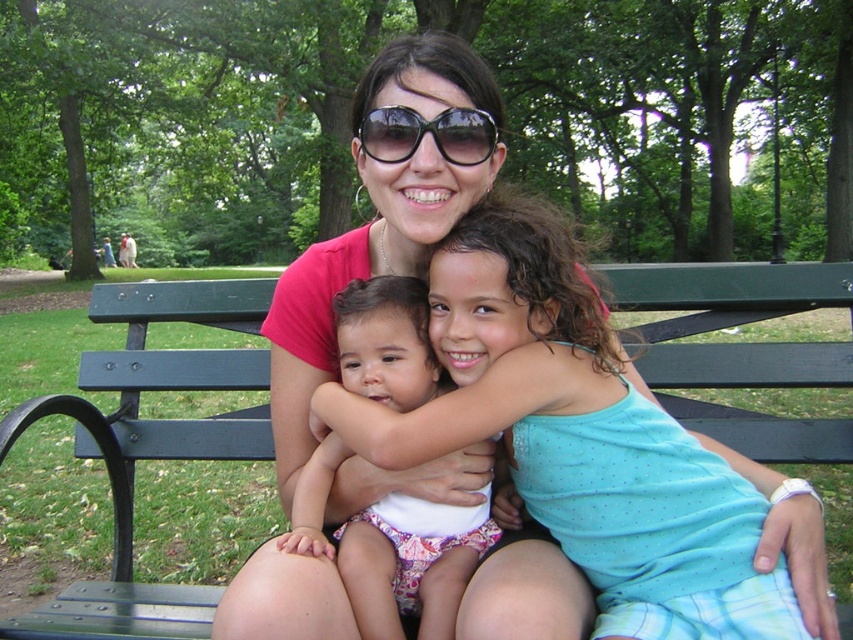
You are a photographer setting up a tripod in the park. You want to place the tripod between the green wood bench at center and the white fabric diaper at center. According to the scene description, which object should the tripod be closer to?

The green wood bench at center is to the left of white fabric diaper at center, so the tripod should be placed closer to the green wood bench at center since it is positioned to the left of the diaper.

You are a photographer taking a picture of the scene. You notice the white fabric diaper at center and the black plastic sunglasses at center. Which object is closer to the bottom edge of the photo?

The white fabric diaper at center is below the black plastic sunglasses at center, so it is closer to the bottom edge of the photo.